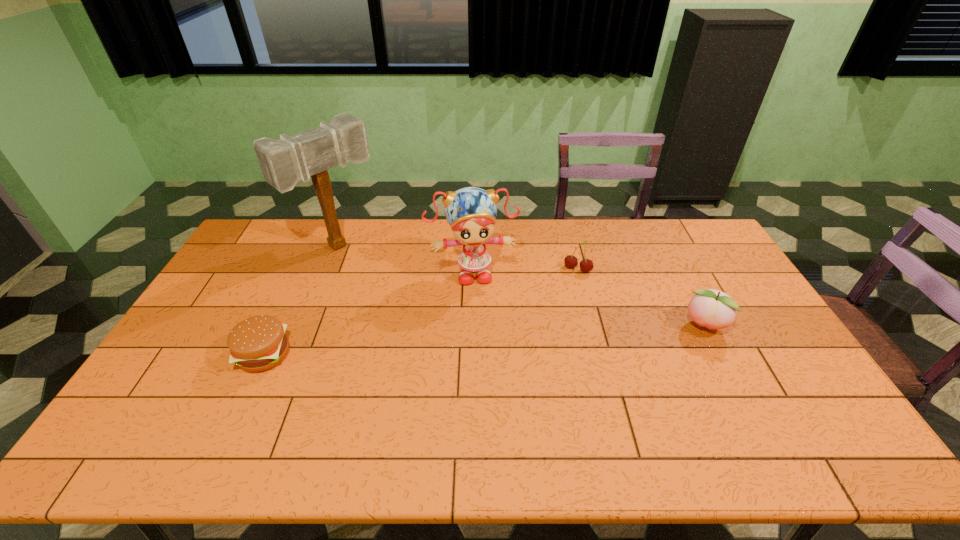
This screenshot has height=540, width=960. What are the coordinates of `free space at the far edge` in the screenshot? It's located at (451, 233).

Locate an element on the screen. Image resolution: width=960 pixels, height=540 pixels. free space at the near edge of the desktop is located at coordinates (730, 417).

Locate an element on the screen. vacant space at the left edge of the desktop is located at coordinates (196, 368).

Where is `vacant position at the right edge of the desktop`? vacant position at the right edge of the desktop is located at coordinates (768, 351).

Find the location of a particular element. The height and width of the screenshot is (540, 960). vacant space at the far left corner is located at coordinates (269, 224).

The height and width of the screenshot is (540, 960). I want to click on vacant region at the near left corner of the desktop, so click(x=197, y=395).

In the image, there is a desktop. Where is `vacant space at the far right corner`? This screenshot has height=540, width=960. vacant space at the far right corner is located at coordinates (686, 221).

Image resolution: width=960 pixels, height=540 pixels. In order to click on free space between the doll and the peach in this screenshot , I will do coord(588,299).

Where is `blank region between the tallest object and the doll`? Image resolution: width=960 pixels, height=540 pixels. blank region between the tallest object and the doll is located at coordinates (406, 258).

Locate an element on the screen. Image resolution: width=960 pixels, height=540 pixels. vacant area between the rightmost object and the cherry is located at coordinates (640, 298).